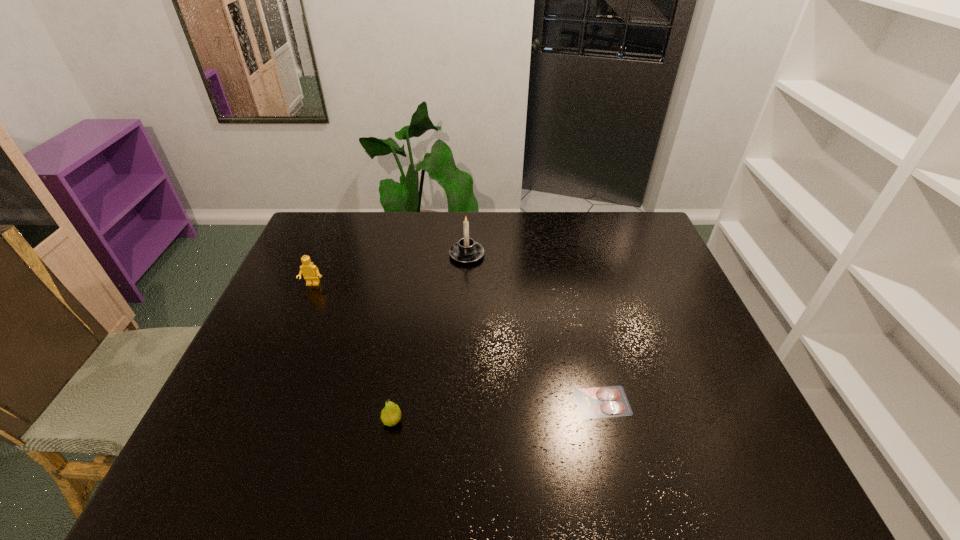
This screenshot has width=960, height=540. Identify the location of free spot between the tallest object and the shortest object. (535, 328).

Find the location of `object that is the closest to the pear`. object that is the closest to the pear is located at coordinates (611, 401).

Find the location of `object that is the second closest to the rightmost object`. object that is the second closest to the rightmost object is located at coordinates (466, 250).

Find the location of a particular element. The image size is (960, 540). free space that satisfies the following two spatial constraints: 1. on the face of the leftmost object; 2. on the right side of the salami is located at coordinates (263, 402).

Image resolution: width=960 pixels, height=540 pixels. I want to click on vacant area in the image that satisfies the following two spatial constraints: 1. on the face of the third nearest object; 2. on the left side of the shortest object, so click(x=263, y=402).

This screenshot has width=960, height=540. Identify the location of free location that satisfies the following two spatial constraints: 1. on the back side of the salami; 2. on the right side of the third object from right to left. (396, 402).

At what (x,y) coordinates should I click in order to perform the action: click on free spot that satisfies the following two spatial constraints: 1. on the face of the pear; 2. on the left side of the second farthest object. Please return your answer as a coordinate pair (x, y). The image size is (960, 540). Looking at the image, I should click on (254, 421).

Image resolution: width=960 pixels, height=540 pixels. In order to click on vacant region that satisfies the following two spatial constraints: 1. on the face of the third nearest object; 2. on the right side of the pear in this screenshot , I will do `click(254, 421)`.